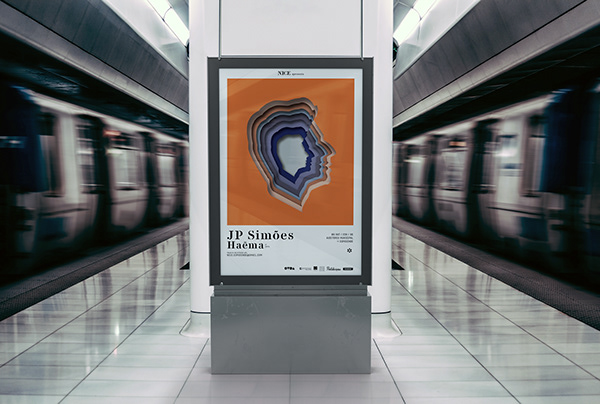
Locate an element on the screen. The width and height of the screenshot is (600, 404). empty space on floor is located at coordinates (465, 329).